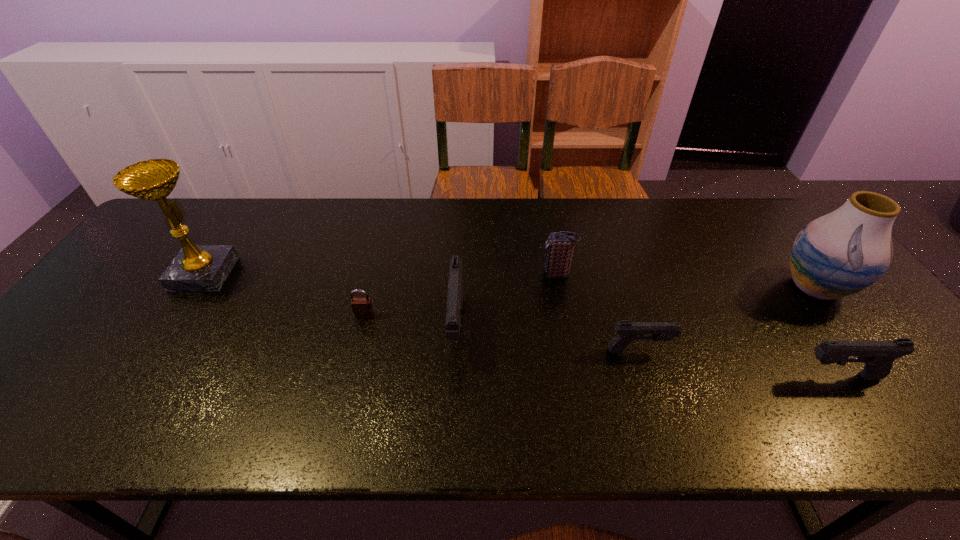
Please point a free position for a pistol on the left. Please provide its 2D coordinates. Your answer should be formatted as a tuple, i.e. [(x, y)], where the tuple contains the x and y coordinates of a point satisfying the conditions above.

[(291, 306)]